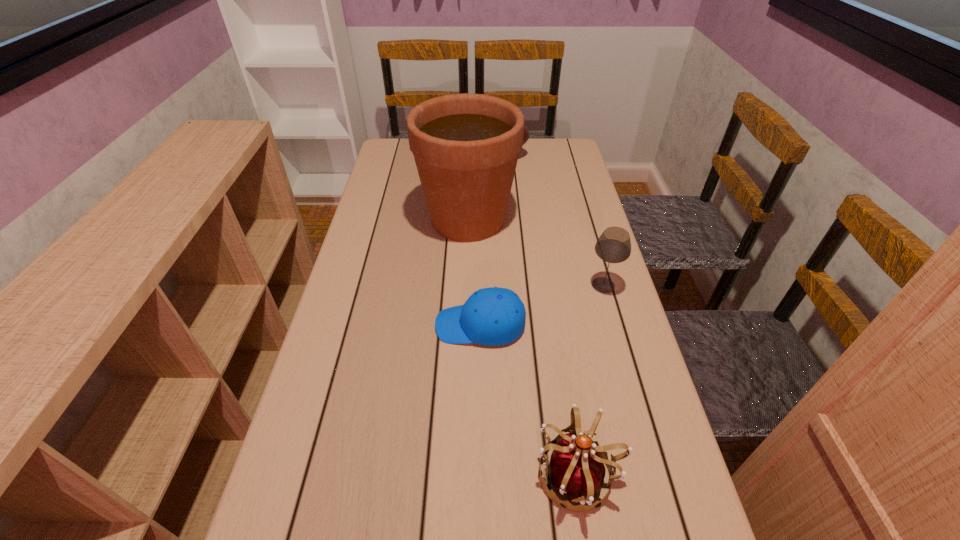
Find the location of a particular element. This screenshot has height=540, width=960. vacant space at the left edge of the desktop is located at coordinates (402, 179).

Where is `free region at the right edge of the desktop`? free region at the right edge of the desktop is located at coordinates (584, 350).

Where is `vacant position at the far left corner of the desktop`? This screenshot has width=960, height=540. vacant position at the far left corner of the desktop is located at coordinates (386, 148).

In order to click on free spot between the flowerpot and the third farthest object in this screenshot , I will do `click(536, 252)`.

I want to click on free spot between the nearest object and the tallest object, so click(x=523, y=347).

At what (x,y) coordinates should I click in order to perform the action: click on free space between the nearest object and the football (American). Please return your answer as a coordinate pair (x, y). This screenshot has width=960, height=540. Looking at the image, I should click on (531, 315).

Identify the location of free spot between the second nearest object and the third nearest object. (541, 305).

At what (x,y) coordinates should I click in order to perform the action: click on vacant point located between the third farthest object and the fourth nearest object. Please return your answer as a coordinate pair (x, y). The height and width of the screenshot is (540, 960). Looking at the image, I should click on point(536,252).

Identify the location of object that can be found as the closest to the tiara. (490, 316).

Identify which object is located as the third nearest to the football (American). Please provide its 2D coordinates. Your answer should be formatted as a tuple, i.e. [(x, y)], where the tuple contains the x and y coordinates of a point satisfying the conditions above.

[(490, 316)]